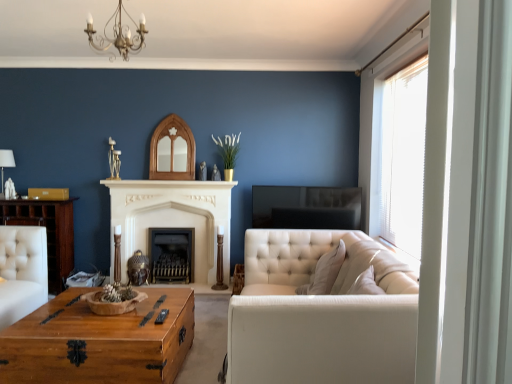
The image size is (512, 384). Find the location of `wooden coffee table at center`. wooden coffee table at center is located at coordinates (99, 341).

What do you see at coordinates (172, 219) in the screenshot? I see `white stone fireplace at center, which ranks as the second fireplace in back-to-front order` at bounding box center [172, 219].

In order to face white fabric couch at right, should I rotate leftwards or rightwards?

Turn right approximately 6.839 degrees to face it.

Locate an element on the screen. white fabric lampshade at left is located at coordinates (6, 162).

Describe the element at coordinates (170, 254) in the screenshot. I see `black metal fireplace at center, the 2th fireplace from the front` at that location.

Locate an element on the screen. The width and height of the screenshot is (512, 384). wooden trunk at left is located at coordinates (47, 232).

Which of these two, wooden coffee table at center or white marble fireplace at center, stands taller?

wooden coffee table at center is taller.

Which object is thinner, wooden coffee table at center or white marble fireplace at center?

With smaller width is white marble fireplace at center.

Is wooden coffee table at center positioned with its back to white marble fireplace at center?

wooden coffee table at center does not have its back to white marble fireplace at center.

Where is `mantle that is above the wooden coffee table at center (from the image's perspective)`? Image resolution: width=512 pixels, height=384 pixels. mantle that is above the wooden coffee table at center (from the image's perspective) is located at coordinates (168, 184).

Is white stone fireplace at center, the 1th fireplace from the front, completely or partially inside gold metallic chandelier at upper center?

No.

Could you measure the distance between gold metallic chandelier at upper center and white stone fireplace at center, which ranks as the second fireplace in back-to-front order?

gold metallic chandelier at upper center and white stone fireplace at center, which ranks as the second fireplace in back-to-front order, are 1.79 meters apart.

In the scene shown: Who is taller, gold metallic chandelier at upper center or white stone fireplace at center, which ranks as the second fireplace in back-to-front order?

white stone fireplace at center, which ranks as the second fireplace in back-to-front order.

Which is behind, point (137, 48) or point (153, 198)?

Point (153, 198)

Find the location of a particular element. hardwood on the left of black metal fireplace at center, the 2th fireplace from the front is located at coordinates (47, 232).

Is wooden trunk at left not within black metal fireplace at center, the 2th fireplace from the front?

That's correct, wooden trunk at left is outside of black metal fireplace at center, the 2th fireplace from the front.

How far apart are wooden trunk at left and black metal fireplace at center, the 2th fireplace from the front?

A distance of 39.05 inches exists between wooden trunk at left and black metal fireplace at center, the 2th fireplace from the front.

Does white fabric couch at right have a larger size compared to wooden coffee table at center?

Indeed, white fabric couch at right has a larger size compared to wooden coffee table at center.

The height and width of the screenshot is (384, 512). What are the coordinates of `studio couch located on the right of wooden coffee table at center` in the screenshot? It's located at (321, 313).

Considering the relative positions of white fabric couch at right and wooden coffee table at center in the image provided, is white fabric couch at right behind wooden coffee table at center?

Yes.

Would you say wooden coffee table at center is part of white fabric couch at right's contents?

No, wooden coffee table at center is not surrounded by white fabric couch at right.

In the scene shown: From the image's perspective, is white stone fireplace at center, the 1th fireplace from the front, above wooden trunk at left?

Yes, from the image's perspective, white stone fireplace at center, the 1th fireplace from the front, is over wooden trunk at left.

Is wooden trunk at left a part of white stone fireplace at center, which ranks as the second fireplace in back-to-front order?

Definitely not — wooden trunk at left is not inside white stone fireplace at center, which ranks as the second fireplace in back-to-front order.

Is white stone fireplace at center, the 1th fireplace from the front, facing away from wooden trunk at left?

white stone fireplace at center, the 1th fireplace from the front, is not turned away from wooden trunk at left.

How far apart are white stone fireplace at center, the 1th fireplace from the front, and wooden trunk at left?

white stone fireplace at center, the 1th fireplace from the front, is 33.82 inches away from wooden trunk at left.

From a real-world perspective, is wooden coffee table at center physically below white fabric lampshade at left?

Yes.

Considering the positions of point (72, 354) and point (7, 153), is point (72, 354) closer or farther from the camera than point (7, 153)?

Point (72, 354) appears to be closer to the viewer than point (7, 153).

Is wooden coffee table at center completely or partially outside of white fabric lampshade at left?

Yes.

Is wooden coffee table at center not near white fabric lampshade at left?

Yes.

Considering the relative sizes of wooden coffee table at center and white fabric couch at right in the image provided, is wooden coffee table at center shorter than white fabric couch at right?

Indeed, wooden coffee table at center has a lesser height compared to white fabric couch at right.

Can you tell me how much wooden coffee table at center and white fabric couch at right differ in facing direction?

They differ by 89 degrees in their facing directions.

Is wooden coffee table at center aimed at white fabric couch at right?

No, wooden coffee table at center is not turned towards white fabric couch at right.

Identify the location of coffee table on the left of white marble fireplace at center. (99, 341).

Locate an element on the screen. The image size is (512, 384). fireplace that is the 1st one when counting backward from the gold metallic chandelier at upper center is located at coordinates (172, 219).

From the picture: Estimate the real-world distances between objects in this image. Which object is further from wooden trunk at left, white stone fireplace at center, the 1th fireplace from the front, or gold metallic chandelier at upper center?

Based on the image, gold metallic chandelier at upper center appears to be further to wooden trunk at left.

From the image, which object appears to be nearer to white stone fireplace at center, the 1th fireplace from the front, wooden trunk at left or gold metallic chandelier at upper center?

wooden trunk at left is positioned closer to the anchor white stone fireplace at center, the 1th fireplace from the front.

Considering their positions, is wooden coffee table at center positioned further to white marble fireplace at center than white fabric couch at right?

wooden coffee table at center lies further to white marble fireplace at center than the other object.

Considering their positions, is white stone fireplace at center, which ranks as the second fireplace in back-to-front order, positioned closer to black metal fireplace at center, the 2th fireplace from the front, than white fabric couch at right?

Among the two, white stone fireplace at center, which ranks as the second fireplace in back-to-front order, is located nearer to black metal fireplace at center, the 2th fireplace from the front.

When comparing their distances from black metal fireplace at center, positioned as the first fireplace in back-to-front order, does white fabric couch at right or white fabric lampshade at left seem further?

white fabric couch at right.

When comparing their distances from white fabric lampshade at left, does white fabric couch at right or white marble fireplace at center seem further?

Among the two, white fabric couch at right is located further to white fabric lampshade at left.

When comparing their distances from wooden trunk at left, does white fabric lampshade at left or black metal fireplace at center, positioned as the first fireplace in back-to-front order, seem further?

The object further to wooden trunk at left is black metal fireplace at center, positioned as the first fireplace in back-to-front order.

Which object lies further to the anchor point wooden coffee table at center, white stone fireplace at center, which ranks as the second fireplace in back-to-front order, or white fabric lampshade at left?

white fabric lampshade at left lies further to wooden coffee table at center than the other object.

Identify the location of light fixture positioned between wooden coffee table at center and black metal fireplace at center, positioned as the first fireplace in back-to-front order, from near to far. (118, 34).

At what (x,y) coordinates should I click in order to perform the action: click on mantle between gold metallic chandelier at upper center and white stone fireplace at center, which ranks as the second fireplace in back-to-front order, from front to back. Please return your answer as a coordinate pair (x, y). The height and width of the screenshot is (384, 512). Looking at the image, I should click on (168, 184).

Locate an element on the screen. hardwood positioned between wooden coffee table at center and black metal fireplace at center, the 2th fireplace from the front, from near to far is located at coordinates (47, 232).

Locate an element on the screen. This screenshot has width=512, height=384. light fixture positioned between white fabric couch at right and white marble fireplace at center from near to far is located at coordinates (118, 34).